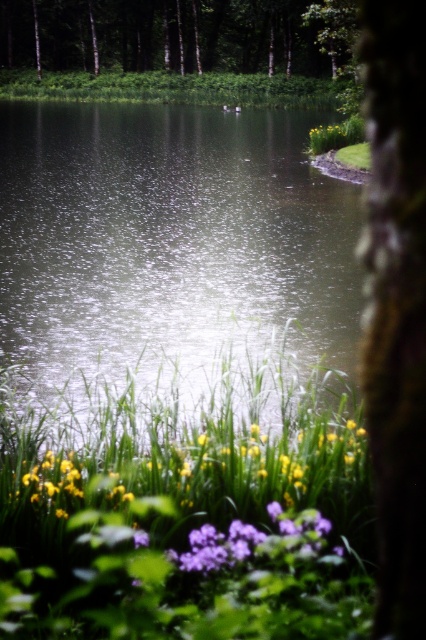
You are standing at the edge of the pond and want to pick the yellow matte flower at upper right. Which direction should you move relative to the glistening water at center?

The yellow matte flower at upper right is located above the glistening water at center, so you should move towards the upper direction relative to the glistening water at center to reach it.

Consider the image. You are standing at the edge of the pond and see two points in the scene. One is labeled as point (290, 131) and the other as point (409, 141). Which point is closer to you?

Point (290, 131) is closer to you because it is further to the viewer than point (409, 141).